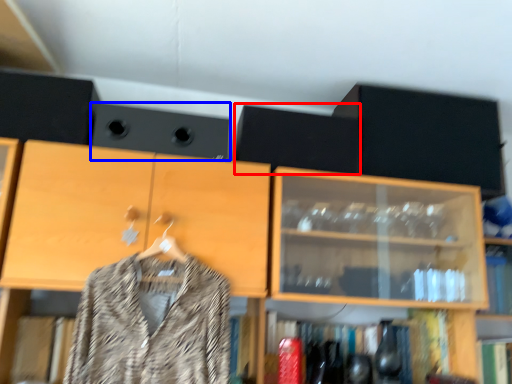
Question: Which of the following is the farthest to the observer, speaker (highlighted by a red box) or speaker (highlighted by a blue box)?

Choices:
 (A) speaker
 (B) speaker

Answer: (A)